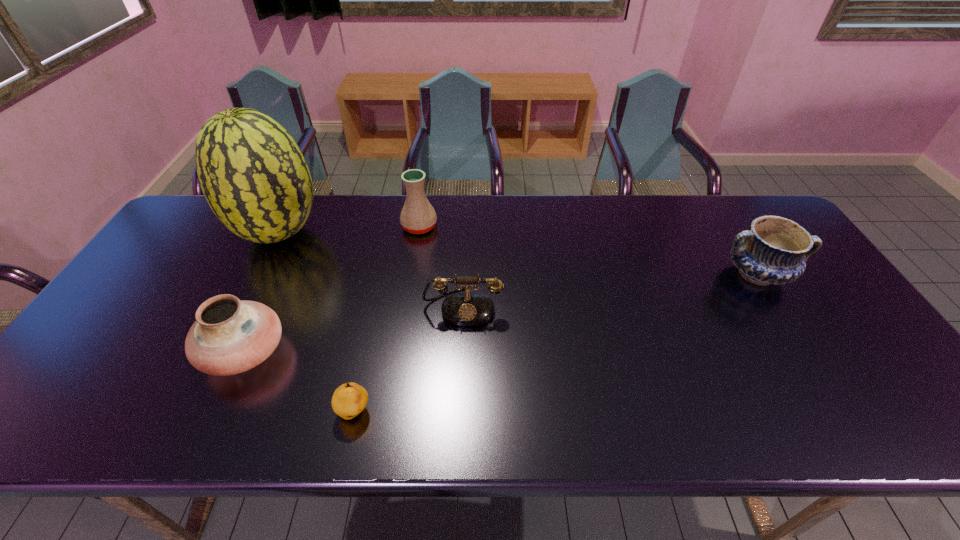
Identify the location of free region at the near edge. (763, 401).

In the image, there is a desktop. Find the location of `vacant space at the left edge`. vacant space at the left edge is located at coordinates (57, 382).

What are the coordinates of `free space at the right edge` in the screenshot? It's located at (876, 360).

This screenshot has height=540, width=960. Identify the location of vacant area at the near right corner. tap(887, 409).

Where is `free area in between the telephone and the tallest object`? This screenshot has height=540, width=960. free area in between the telephone and the tallest object is located at coordinates (371, 270).

Locate an element on the screen. The image size is (960, 540). free space between the telephone and the leftmost pottery is located at coordinates (353, 329).

The height and width of the screenshot is (540, 960). In order to click on vacant space that's between the shortest object and the rightmost pottery in this screenshot , I will do `click(556, 343)`.

Where is `free spot between the tallest object and the telephone`? free spot between the tallest object and the telephone is located at coordinates (371, 270).

Find the location of a particular element. This screenshot has height=540, width=960. free point between the tallest object and the nearest pottery is located at coordinates (262, 293).

The image size is (960, 540). Identify the location of unoccupied position between the fifth tallest object and the watermelon. (371, 270).